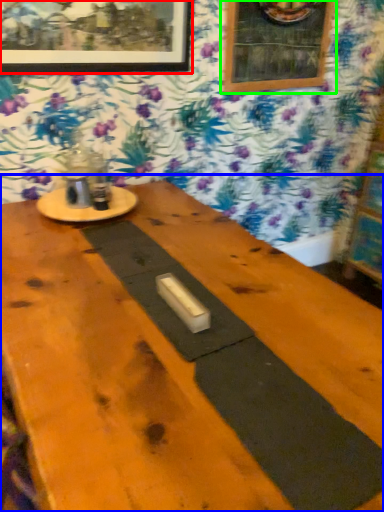
Question: Which is farther away from picture frame (highlighted by a red box)? table (highlighted by a blue box) or picture frame (highlighted by a green box)?

Choices:
 (A) table
 (B) picture frame

Answer: (A)